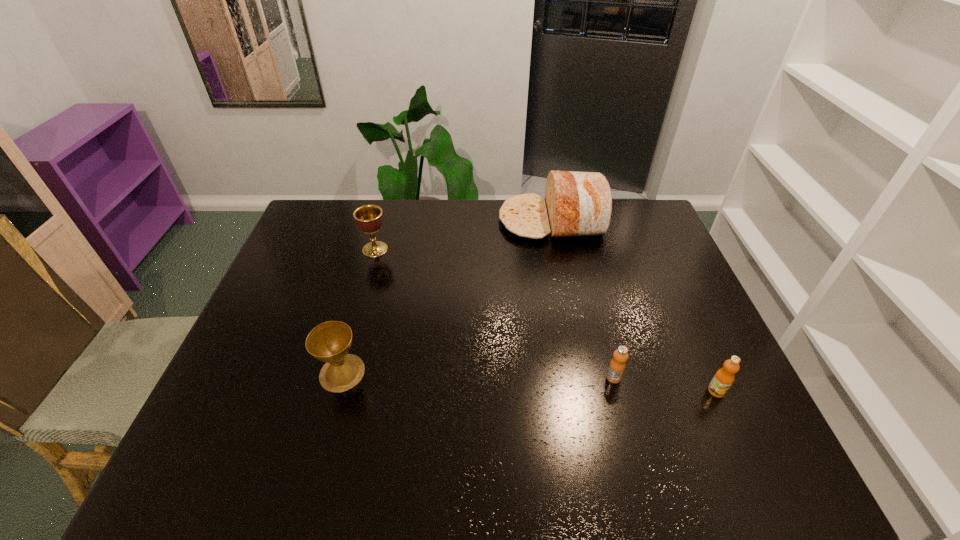
The image size is (960, 540). Identify the location of free space located 0.150m on the front label of the rightmost object. (748, 460).

This screenshot has height=540, width=960. What are the coordinates of `free space located 0.210m on the front label of the left orange juice` in the screenshot? It's located at (637, 470).

Locate an element on the screen. The height and width of the screenshot is (540, 960). object present at the far edge is located at coordinates coord(577,204).

Find the location of a particular element. The height and width of the screenshot is (540, 960). object that is at the right edge is located at coordinates (723, 379).

In order to click on vacant region at the far edge in this screenshot , I will do `click(606, 232)`.

The image size is (960, 540). I want to click on vacant region at the left edge of the desktop, so click(242, 440).

Locate an element on the screen. The height and width of the screenshot is (540, 960). vacant area at the right edge is located at coordinates (647, 241).

Locate an element on the screen. free region at the far left corner of the desktop is located at coordinates (300, 224).

This screenshot has width=960, height=540. Identify the location of vacant space at the near left corner of the desktop. (197, 443).

You are a GUI agent. You are given a task and a screenshot of the screen. Output one action in this format:
    pyautogui.click(x=<x>, y=<y>)
    Task: Click on the empty location between the farther chalice and the bread
    The height and width of the screenshot is (540, 960).
    Given the screenshot: What is the action you would take?
    pyautogui.click(x=464, y=235)